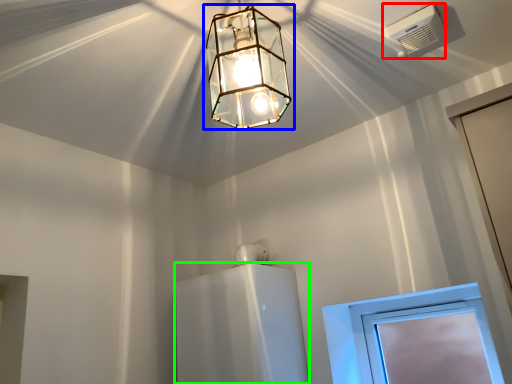
Question: Estimate the real-world distances between objects in this image. Which object is farther from air conditioning (highlighted by a red box), lamp (highlighted by a blue box) or appliance (highlighted by a green box)?

Choices:
 (A) lamp
 (B) appliance

Answer: (B)